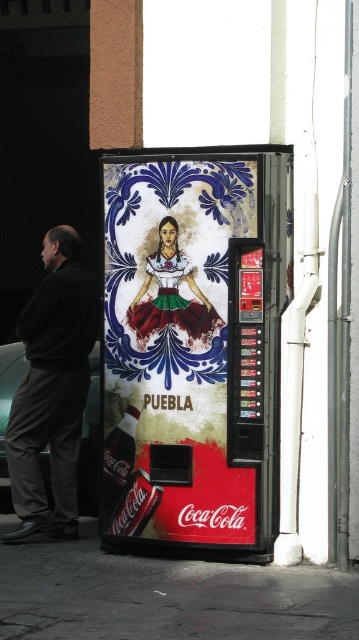
Describe the element at coordinates (197, 339) in the screenshot. I see `matte plastic vending machine at center` at that location.

Where is `matte plastic vending machine at center`? The width and height of the screenshot is (359, 640). matte plastic vending machine at center is located at coordinates (197, 339).

Between dark gray pants at left and matte ceramic woman at center, which one is positioned higher?

Positioned higher is matte ceramic woman at center.

Does dark gray pants at left have a greater height compared to matte ceramic woman at center?

Yes, dark gray pants at left is taller than matte ceramic woman at center.

Is point (17, 532) positioned in front of point (165, 305)?

No, (17, 532) is behind (165, 305).

Image resolution: width=359 pixels, height=640 pixels. In order to click on dark gray pants at left in this screenshot , I will do `click(52, 388)`.

Measure the distance from matte red can at lower center to matte plastic coca-cola can at center.

matte red can at lower center is 7.70 inches from matte plastic coca-cola can at center.

Is matte red can at lower center to the left of matte plastic coca-cola can at center from the viewer's perspective?

Incorrect, matte red can at lower center is not on the left side of matte plastic coca-cola can at center.

Which is behind, point (119, 500) or point (109, 458)?

The point (109, 458) is more distant.

At what (x,y) coordinates should I click in order to perform the action: click on matte red can at lower center. Please return your answer as a coordinate pair (x, y). Looking at the image, I should click on (136, 506).